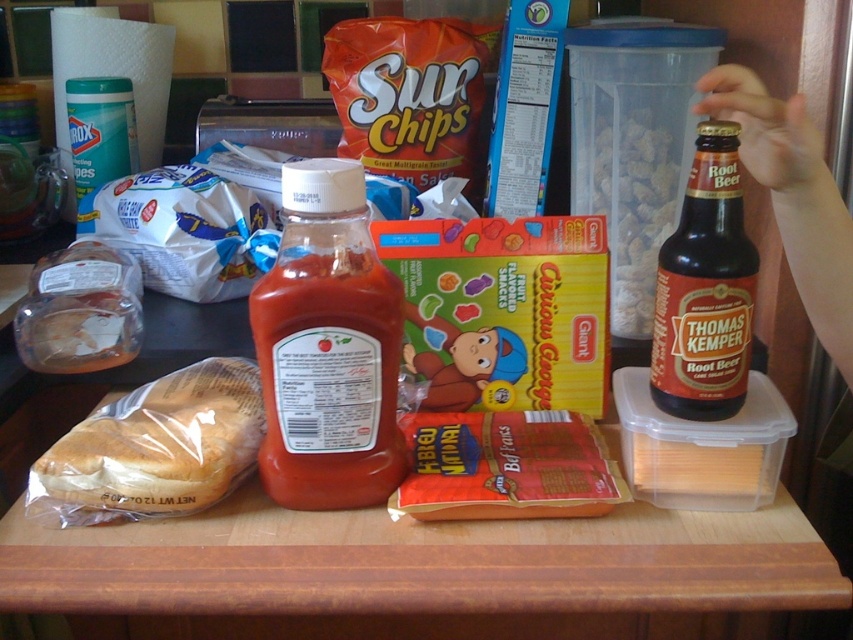
Which of these two, translucent plastic bottle at center or brown glass bottle at right, stands taller?

With more height is translucent plastic bottle at center.

Is translucent plastic bottle at center to the right of brown glass bottle at right from the viewer's perspective?

In fact, translucent plastic bottle at center is to the left of brown glass bottle at right.

What do you see at coordinates (328, 348) in the screenshot? I see `translucent plastic bottle at center` at bounding box center [328, 348].

I want to click on translucent plastic bottle at center, so click(328, 348).

Can you confirm if translucent plastic container at center-right is positioned to the right of translucent plastic sandwich at left?

Yes, translucent plastic container at center-right is to the right of translucent plastic sandwich at left.

Is translucent plastic container at center-right shorter than translucent plastic sandwich at left?

No, translucent plastic container at center-right is not shorter than translucent plastic sandwich at left.

What do you see at coordinates (635, 195) in the screenshot?
I see `translucent plastic container at center-right` at bounding box center [635, 195].

Locate an element on the screen. This screenshot has height=640, width=853. translucent plastic container at center-right is located at coordinates (635, 195).

Between point (328, 435) and point (619, 116), which one is positioned behind?

Positioned behind is point (619, 116).

Does point (323, 320) come behind point (625, 337)?

That is False.

Identify the location of translucent plastic bottle at center. The image size is (853, 640). (328, 348).